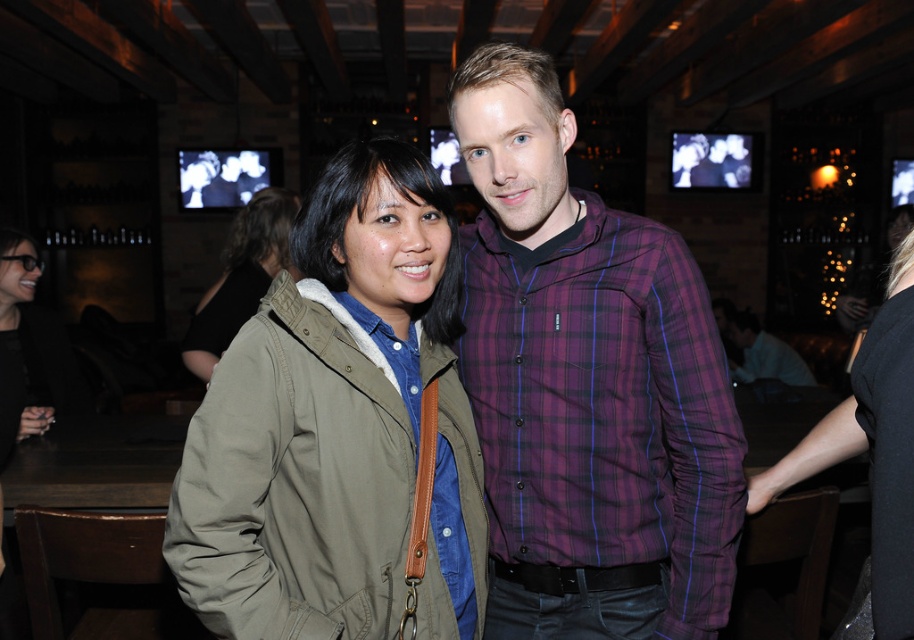
Is plaid fabric shirt at center above khaki fabric jacket at center?

No, plaid fabric shirt at center is not above khaki fabric jacket at center.

Does plaid fabric shirt at center have a lesser width compared to khaki fabric jacket at center?

Result: No.

Measure the distance between point (643, 557) and camera.

The distance of point (643, 557) from camera is 1.29 meters.

I want to click on plaid fabric shirt at center, so click(587, 385).

Does plaid fabric shirt at center have a lesser width compared to olive green jacket at center?

No.

Between point (682, 561) and point (360, 464), which one is positioned behind?

Point (682, 561)

This screenshot has width=914, height=640. Find the location of `plaid fabric shirt at center`. plaid fabric shirt at center is located at coordinates (587, 385).

Is black fabric dress at lower right smaller than matte black jacket at lower left?

Actually, black fabric dress at lower right might be larger than matte black jacket at lower left.

Which of these two, black fabric dress at lower right or matte black jacket at lower left, stands taller?

With more height is black fabric dress at lower right.

Describe the element at coordinates (870, 460) in the screenshot. I see `black fabric dress at lower right` at that location.

At what (x,y) coordinates should I click in order to perform the action: click on black fabric dress at lower right. Please return your answer as a coordinate pair (x, y). Looking at the image, I should click on (870, 460).